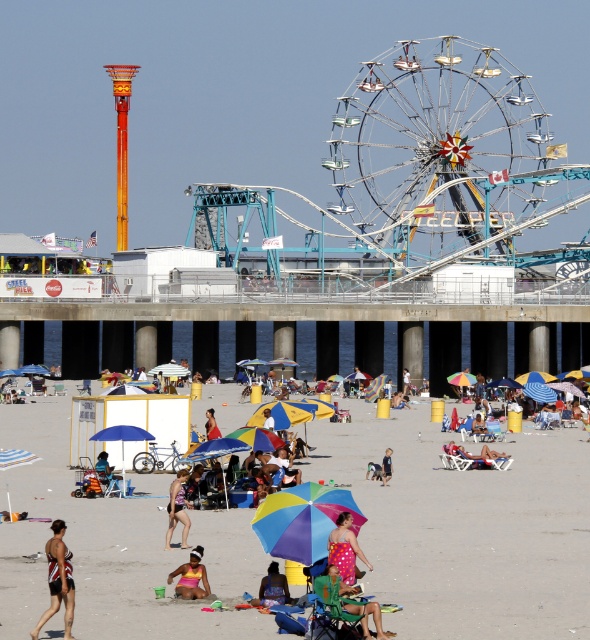
Which is in front, point (227, 385) or point (214, 429)?

Point (214, 429)

Does multicolored umbrellas at center appear over red fabric umbrella at center?

Incorrect, multicolored umbrellas at center is not positioned above red fabric umbrella at center.

Does point (523, 426) lie in front of point (208, 429)?

That is False.

The width and height of the screenshot is (590, 640). What are the coordinates of `multicolored umbrellas at center` in the screenshot? It's located at (467, 528).

Between metallic silver ferris wheel at center and rainbow fabric umbrella at center, which one has more height?

Standing taller between the two is metallic silver ferris wheel at center.

Which is below, metallic silver ferris wheel at center or rainbow fabric umbrella at center?

rainbow fabric umbrella at center is lower down.

Is point (457, 134) farther from camera compared to point (283, 552)?

Yes.

The height and width of the screenshot is (640, 590). Find the location of `metallic silver ferris wheel at center`. metallic silver ferris wheel at center is located at coordinates (434, 140).

Between pink polka dot dress at center and multicolored umbrella at center, which one is positioned lower?

multicolored umbrella at center is below.

Between pink polka dot dress at center and multicolored umbrella at center, which one has less height?

multicolored umbrella at center is shorter.

The width and height of the screenshot is (590, 640). Identify the location of pink polka dot dress at center. (345, 548).

Identify the location of pink polka dot dress at center. (345, 548).